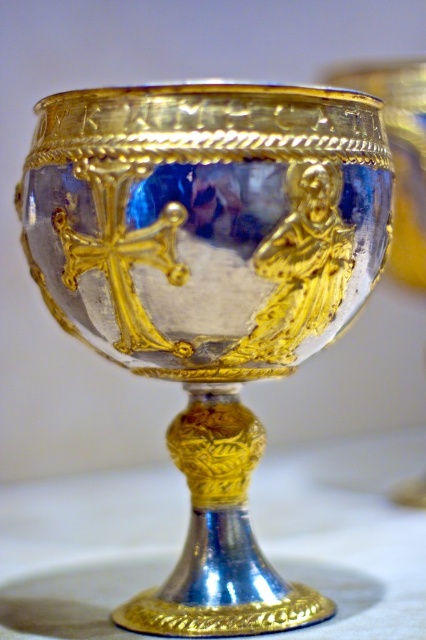
Question: Does white fabric at center have a lesser width compared to gold/glass goblet at center?

Choices:
 (A) no
 (B) yes

Answer: (A)

Question: Which point is closer to the camera?

Choices:
 (A) (94, 538)
 (B) (409, 257)

Answer: (A)

Question: Observing the image, what is the correct spatial positioning of white fabric at center in reference to gold/glass goblet at center?

Choices:
 (A) left
 (B) right

Answer: (A)

Question: Among these points, which one is farthest from the camera?

Choices:
 (A) (425, 97)
 (B) (324, 518)

Answer: (B)

Question: Can you confirm if white fabric at center is thinner than gold/glass goblet at center?

Choices:
 (A) no
 (B) yes

Answer: (A)